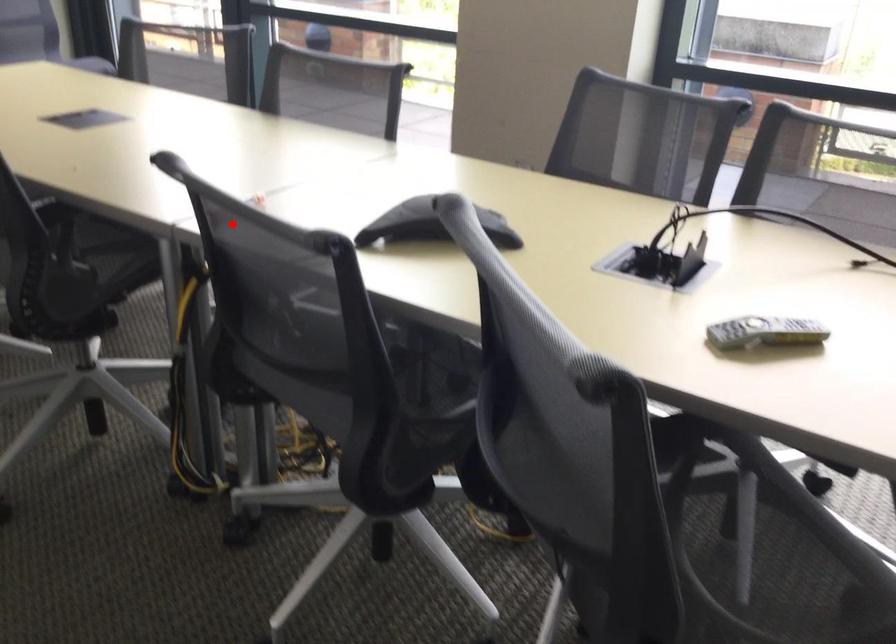
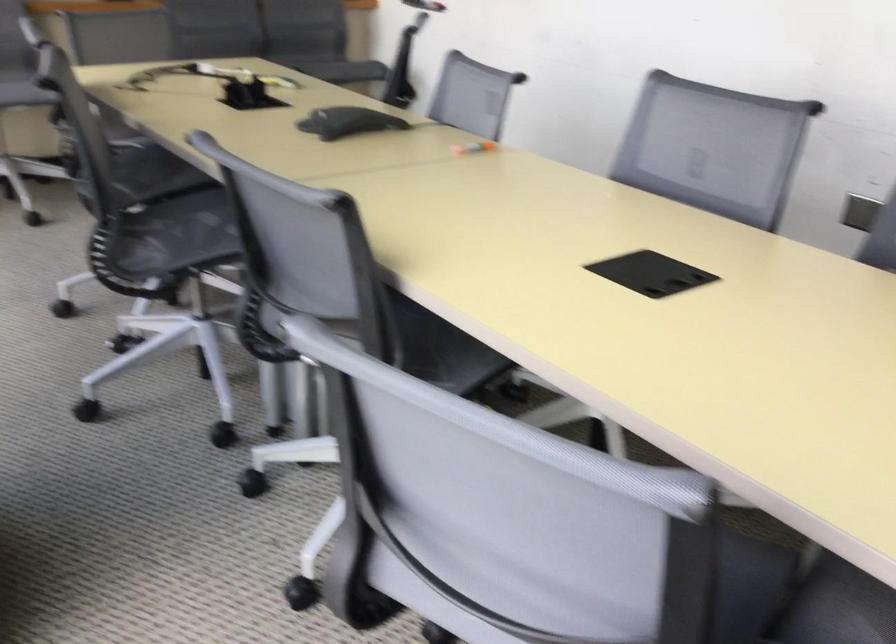
Locate, in the second image, the point that corresponds to the highlighted location in the first image.

(474, 147)